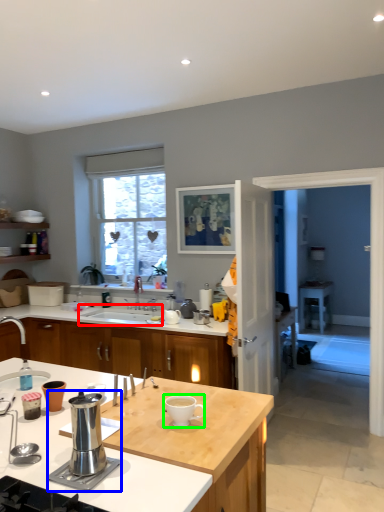
Question: Based on their relative distances, which object is nearer to sink (highlighted by a red box)? Choose from appliance (highlighted by a blue box) and coffee cup (highlighted by a green box).

Choices:
 (A) appliance
 (B) coffee cup

Answer: (B)